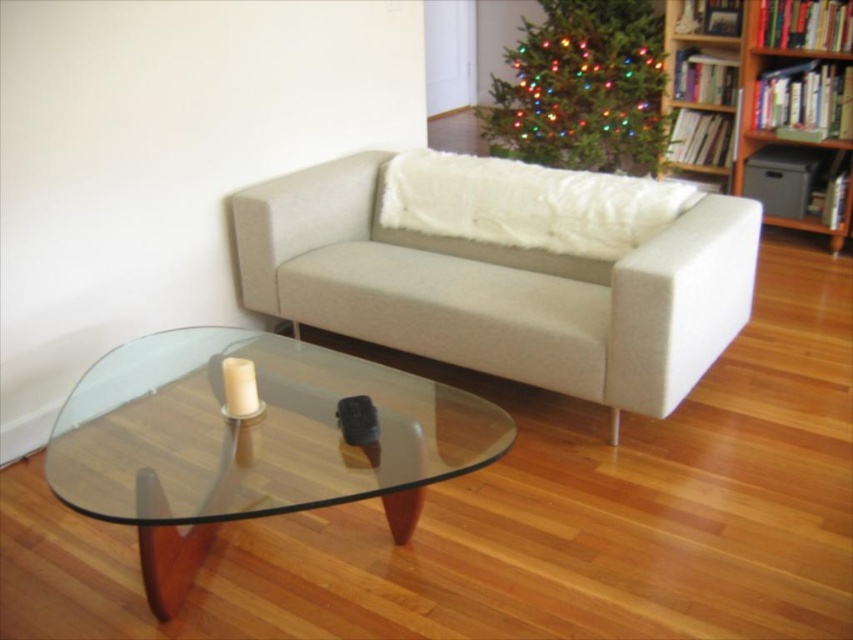
Identify the location of transparent glass coffee table at center. (252, 440).

Which is more to the right, transparent glass coffee table at center or multicolored lights christmas tree at upper center?

Positioned to the right is multicolored lights christmas tree at upper center.

Does point (398, 412) lie in front of point (541, 4)?

Yes, it is.

Find the location of a particular element. The height and width of the screenshot is (640, 853). transparent glass coffee table at center is located at coordinates (252, 440).

Is beige fabric couch at center in front of transparent glass coffee table at center?

That is False.

Does beige fabric couch at center appear over transparent glass coffee table at center?

Yes.

Does point (560, 387) come farther from viewer compared to point (112, 444)?

That is True.

This screenshot has height=640, width=853. I want to click on beige fabric couch at center, so click(500, 289).

Measure the distance from transparent glass coffee table at center to wooden bookshelf at upper right.

A distance of 2.86 meters exists between transparent glass coffee table at center and wooden bookshelf at upper right.

Does point (408, 412) come closer to viewer compared to point (666, 8)?

Yes, point (408, 412) is closer to viewer.

Locate an element on the screen. This screenshot has height=640, width=853. transparent glass coffee table at center is located at coordinates (252, 440).